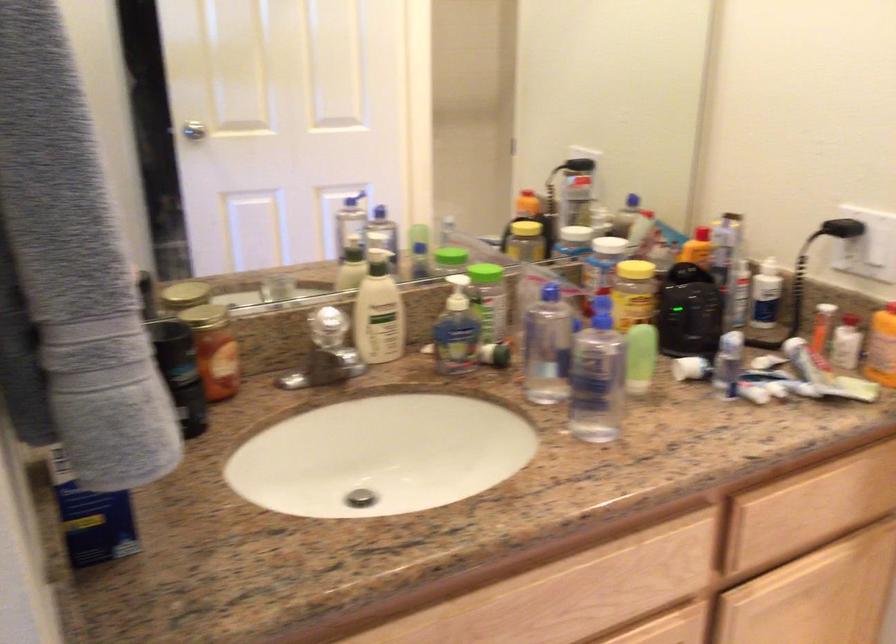
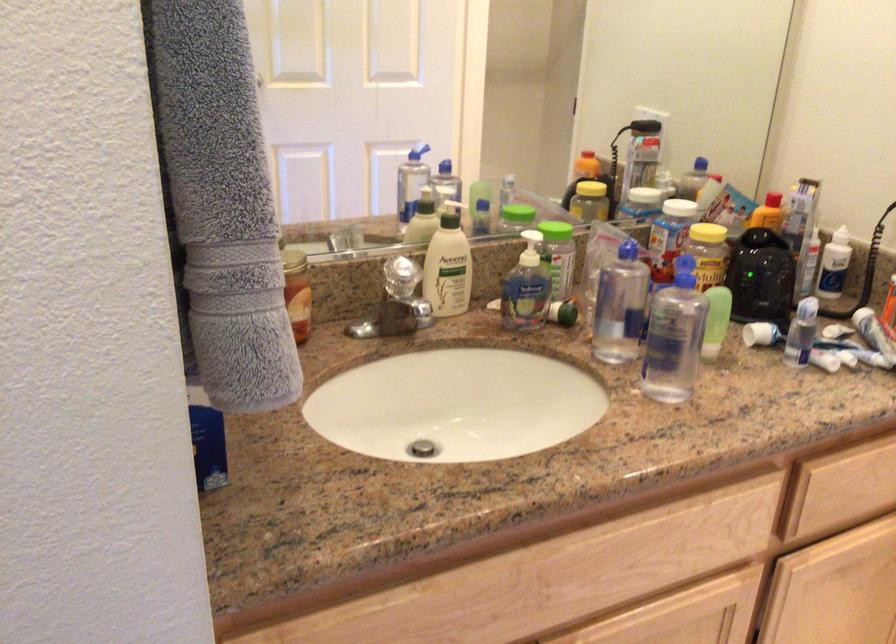
Where in the second image is the point corresponding to pixel 768 371 from the first image?

(839, 339)